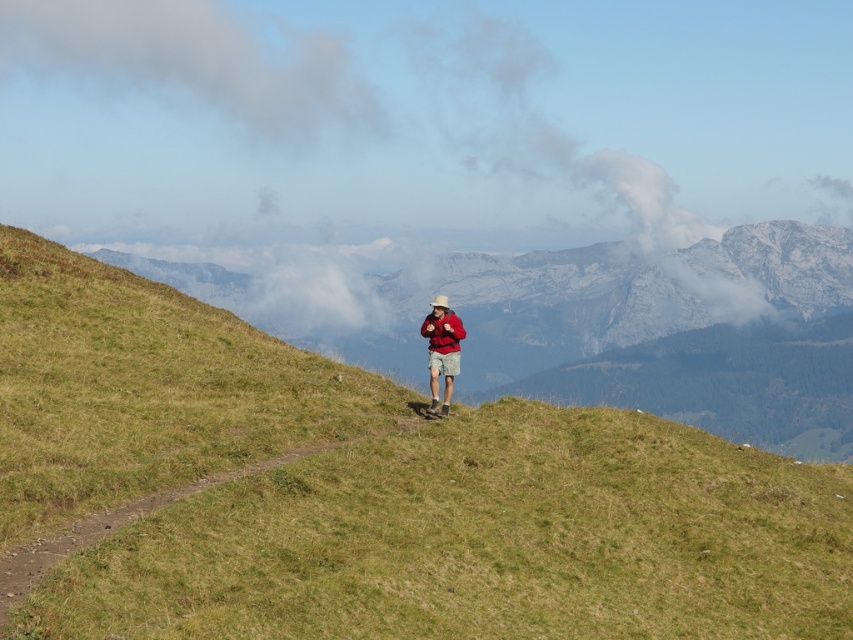
You are a hiker planning to walk along the dirt path. Based on the scene, which is closer to you between the green grassy hillside at center and the brown dirt path at center?

The brown dirt path at center is closer to you than the green grassy hillside at center because the green grassy hillside at center is further away.

Based on the scene, if you were the hiker wearing the matte red jacket at center, which direction would you look to see the gray cotton cloud at upper left?

The gray cotton cloud at upper left is to the left of the matte red jacket at center, so the hiker should look to their left to see it.